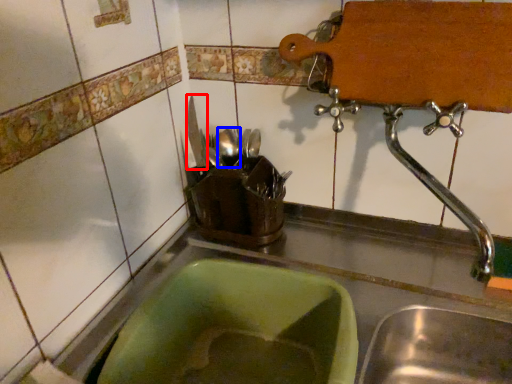
Question: Which point is closer to the camera, tableware (highlighted by a red box) or tableware (highlighted by a blue box)?

Choices:
 (A) tableware
 (B) tableware

Answer: (B)